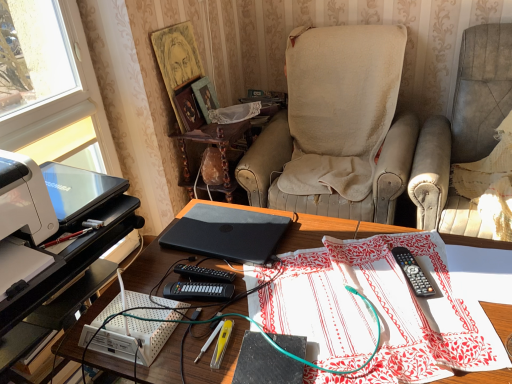
Question: Could you tell me if black plastic remote control at center, acting as the 2th stationery starting from the left, is facing orange matte laptop at center, placed as the 2th laptop when sorted from left to right?

Choices:
 (A) no
 (B) yes

Answer: (A)

Question: Is black plastic remote control at center, acting as the 2th stationery starting from the left, positioned behind orange matte laptop at center, the first laptop from the right?

Choices:
 (A) yes
 (B) no

Answer: (B)

Question: Is black plastic remote control at center, acting as the 2th stationery starting from the left, positioned beyond the bounds of orange matte laptop at center, placed as the 2th laptop when sorted from left to right?

Choices:
 (A) yes
 (B) no

Answer: (A)

Question: From a real-world perspective, does black plastic remote control at center, acting as the 2th stationery starting from the left, sit lower than orange matte laptop at center, the first laptop from the right?

Choices:
 (A) no
 (B) yes

Answer: (B)

Question: Is black plastic remote control at center, the 1th stationery from the right, positioned before orange matte laptop at center, placed as the 2th laptop when sorted from left to right?

Choices:
 (A) yes
 (B) no

Answer: (A)

Question: Looking at the image, does wooden polished side table at center seem bigger or smaller compared to white plastic printer at left?

Choices:
 (A) big
 (B) small

Answer: (A)

Question: Considering the positions of point (236, 125) and point (50, 259), is point (236, 125) closer or farther from the camera than point (50, 259)?

Choices:
 (A) farther
 (B) closer

Answer: (A)

Question: Is wooden polished side table at center situated inside white plastic printer at left or outside?

Choices:
 (A) outside
 (B) inside

Answer: (A)

Question: From the image's perspective, relative to white plastic printer at left, is wooden polished side table at center above or below?

Choices:
 (A) above
 (B) below

Answer: (A)

Question: In terms of height, does matte black laptop at center look taller or shorter compared to black plastic keyboard at center, acting as the 2th stationery starting from the right?

Choices:
 (A) short
 (B) tall

Answer: (B)

Question: Is matte black laptop at center inside the boundaries of black plastic keyboard at center, acting as the 2th stationery starting from the right, or outside?

Choices:
 (A) outside
 (B) inside

Answer: (A)

Question: Relative to black plastic keyboard at center, acting as the 2th stationery starting from the right, is matte black laptop at center in front or behind?

Choices:
 (A) front
 (B) behind

Answer: (A)

Question: From the image's perspective, is matte black laptop at center above or below black plastic keyboard at center, acting as the 2th stationery starting from the right?

Choices:
 (A) below
 (B) above

Answer: (A)

Question: Do you think orange matte laptop at center, placed as the 2th laptop when sorted from left to right, is within black plastic keyboard at center, acting as the 2th stationery starting from the right, or outside of it?

Choices:
 (A) inside
 (B) outside

Answer: (B)

Question: Is orange matte laptop at center, the first laptop from the right, taller or shorter than black plastic keyboard at center, acting as the 2th stationery starting from the right?

Choices:
 (A) tall
 (B) short

Answer: (B)